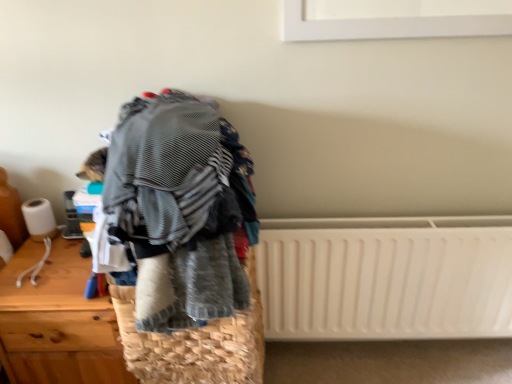
Question: Is wooden chest of drawers at left shorter than woven straw basket at center?

Choices:
 (A) yes
 (B) no

Answer: (B)

Question: Is wooden chest of drawers at left smaller than woven straw basket at center?

Choices:
 (A) yes
 (B) no

Answer: (B)

Question: From a real-world perspective, does wooden chest of drawers at left stand above woven straw basket at center?

Choices:
 (A) no
 (B) yes

Answer: (A)

Question: From a real-world perspective, is wooden chest of drawers at left physically below woven straw basket at center?

Choices:
 (A) no
 (B) yes

Answer: (B)

Question: Is wooden chest of drawers at left facing away from woven straw basket at center?

Choices:
 (A) no
 (B) yes

Answer: (A)

Question: Visually, is woven straw basket at center positioned to the left or to the right of white plastic radiator at lower right?

Choices:
 (A) left
 (B) right

Answer: (A)

Question: Is point (196, 367) positioned closer to the camera than point (417, 278)?

Choices:
 (A) closer
 (B) farther

Answer: (A)

Question: Considering the positions of woven straw basket at center and white plastic radiator at lower right in the image, is woven straw basket at center wider or thinner than white plastic radiator at lower right?

Choices:
 (A) wide
 (B) thin

Answer: (A)

Question: Is woven straw basket at center in front of or behind white plastic radiator at lower right in the image?

Choices:
 (A) front
 (B) behind

Answer: (A)

Question: From the image's perspective, is woven straw basket at center located above or below wooden chest of drawers at left?

Choices:
 (A) below
 (B) above

Answer: (B)

Question: In the image, is woven straw basket at center on the left side or the right side of wooden chest of drawers at left?

Choices:
 (A) right
 (B) left

Answer: (A)

Question: Looking at their shapes, would you say woven straw basket at center is wider or thinner than wooden chest of drawers at left?

Choices:
 (A) wide
 (B) thin

Answer: (B)

Question: Based on their sizes in the image, would you say woven straw basket at center is bigger or smaller than wooden chest of drawers at left?

Choices:
 (A) small
 (B) big

Answer: (A)

Question: Looking at their shapes, would you say woven straw basket at center is wider or thinner than striped fabric at center?

Choices:
 (A) wide
 (B) thin

Answer: (B)

Question: From the image's perspective, relative to striped fabric at center, is woven straw basket at center above or below?

Choices:
 (A) below
 (B) above

Answer: (A)